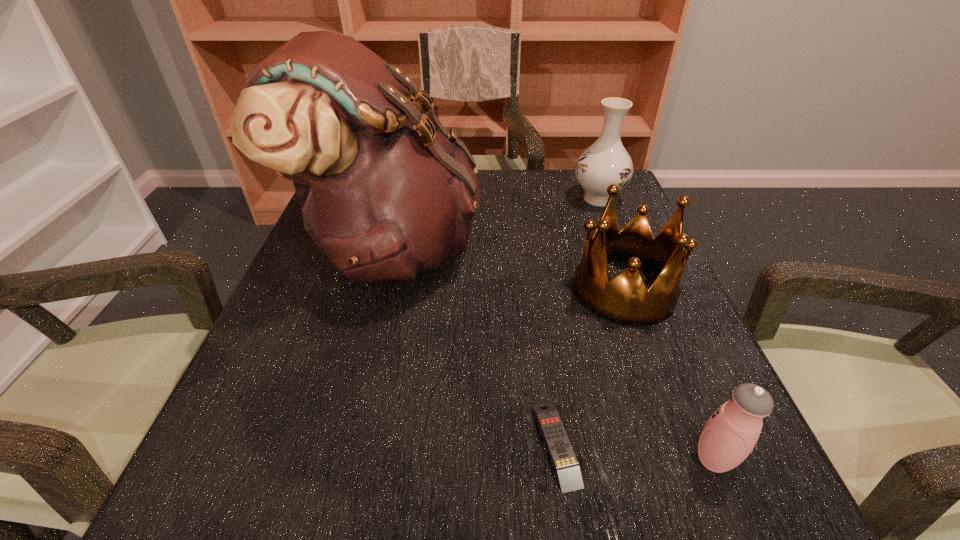
Find the location of `free point between the thermos bottle and the vase`. free point between the thermos bottle and the vase is located at coordinates (656, 329).

Where is `vacant space that's between the shortest object and the thermos bottle`? This screenshot has height=540, width=960. vacant space that's between the shortest object and the thermos bottle is located at coordinates (635, 451).

You are a GUI agent. You are given a task and a screenshot of the screen. Output one action in this format:
    pyautogui.click(x=<x>, y=<y>)
    Task: Click on the free space that is in between the tallest object and the crown
    
    Given the screenshot: What is the action you would take?
    pyautogui.click(x=509, y=269)

Identify the location of free space between the second object from left to right and the crown. The width and height of the screenshot is (960, 540). pos(589,367).

Locate an element on the screen. vacant area that lies between the vase and the second shortest object is located at coordinates (656, 329).

Find the location of `unoccupied area between the thermos bottle and the tallest object`. unoccupied area between the thermos bottle and the tallest object is located at coordinates (553, 354).

Where is `free area in between the fourth tallest object and the crown`? Image resolution: width=960 pixels, height=540 pixels. free area in between the fourth tallest object and the crown is located at coordinates (668, 374).

Identify which object is the fourth closest to the tallest object. Please provide its 2D coordinates. Your answer should be formatted as a tuple, i.e. [(x, y)], where the tuple contains the x and y coordinates of a point satisfying the conditions above.

[(730, 434)]

Select which object is the second closest to the crown. Please provide its 2D coordinates. Your answer should be formatted as a tuple, i.e. [(x, y)], where the tuple contains the x and y coordinates of a point satisfying the conditions above.

[(606, 161)]

Find the location of `vacant space that satisfies the following two spatial constraints: 1. at the front of the remote control with buckles; 2. on the right side of the tallest object`. vacant space that satisfies the following two spatial constraints: 1. at the front of the remote control with buckles; 2. on the right side of the tallest object is located at coordinates (345, 444).